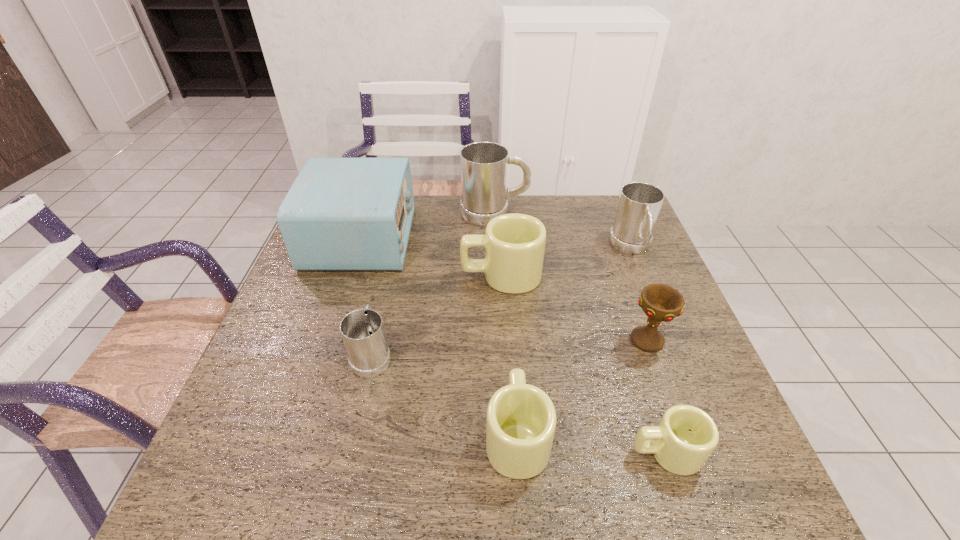
At what (x,y) coordinates should I click in order to perform the action: click on free space between the second smallest gray mug and the leftmost mug. Please return your answer as a coordinate pair (x, y). Image resolution: width=960 pixels, height=540 pixels. Looking at the image, I should click on (502, 301).

What are the coordinates of `empty space that is in between the rightmost gray mug and the leftmost mug` in the screenshot? It's located at (502, 301).

Locate an element on the screen. This screenshot has width=960, height=540. free space between the radio receiver and the farthest beige mug is located at coordinates (431, 256).

You are a GUI agent. You are given a task and a screenshot of the screen. Output one action in this format:
    pyautogui.click(x=<x>, y=<y>)
    Task: Click on the vacant space in between the smallest gray mug and the second farthest gray mug
    
    Given the screenshot: What is the action you would take?
    pyautogui.click(x=502, y=301)

Locate an element on the screen. free spot between the farthest beige mug and the smallest gray mug is located at coordinates (437, 315).

At what (x,y) coordinates should I click in order to perform the action: click on vacant space that's between the second smallest beige mug and the radio receiver. Please return your answer as a coordinate pair (x, y). Image resolution: width=960 pixels, height=540 pixels. Looking at the image, I should click on (439, 336).

You are a GUI agent. You are given a task and a screenshot of the screen. Output one action in this format:
    pyautogui.click(x=<x>, y=<y>)
    Task: Click on the free point between the biggest beige mug and the radio receiver
    
    Given the screenshot: What is the action you would take?
    pyautogui.click(x=431, y=256)

Where is `free point between the leftmost mug and the farthest gray mug`? This screenshot has height=540, width=960. free point between the leftmost mug and the farthest gray mug is located at coordinates (433, 284).

This screenshot has height=540, width=960. I want to click on free space between the biggest beige mug and the nearest gray mug, so click(437, 315).

Where is `object that can be found as the sixth closest to the farthest beige mug`? The image size is (960, 540). object that can be found as the sixth closest to the farthest beige mug is located at coordinates (521, 420).